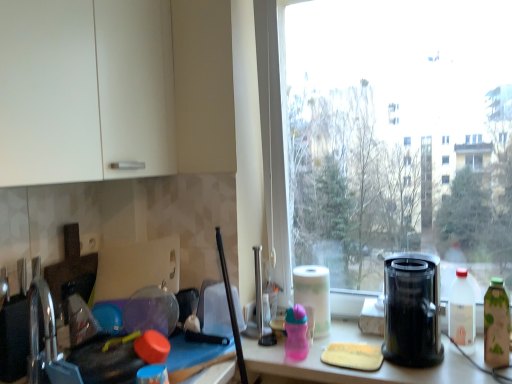
Locate an element on the screen. Image resolution: width=512 pixels, height=384 pixels. vacant area on top of black plastic juicer at right (from a real-world perspective) is located at coordinates (406, 256).